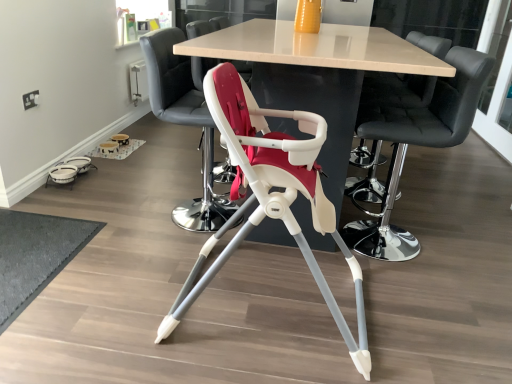
Where is `vacant region under smooth black bar stool at center, marked as the 4th chair in a left-to-right arrangement (from a real-world perspective)`? vacant region under smooth black bar stool at center, marked as the 4th chair in a left-to-right arrangement (from a real-world perspective) is located at coordinates (391, 188).